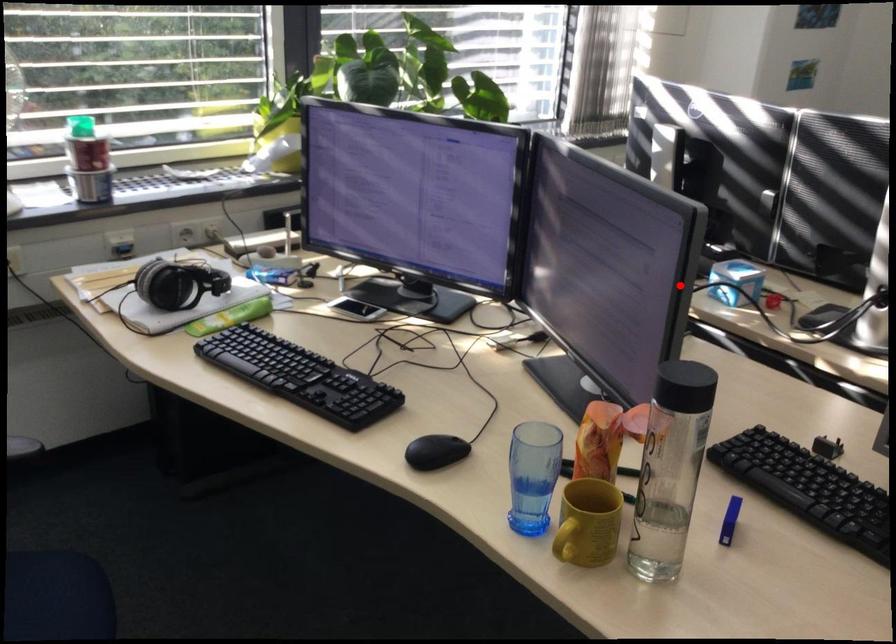
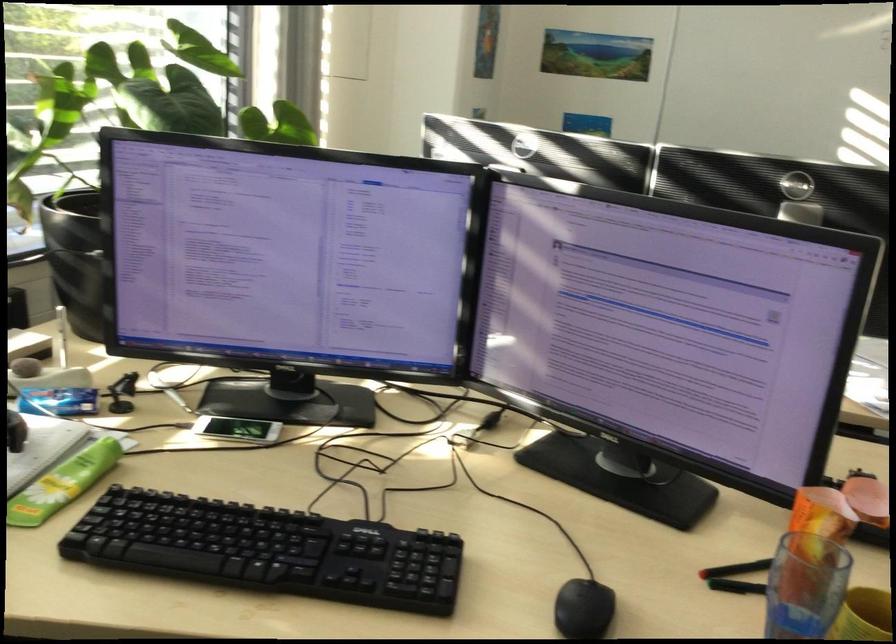
Question: I am providing you with two images of the same scene from different viewpoints. A red point is marked on the first image. Can you still see the location of the red point in image 2?

Choices:
 (A) Yes
 (B) No

Answer: (A)